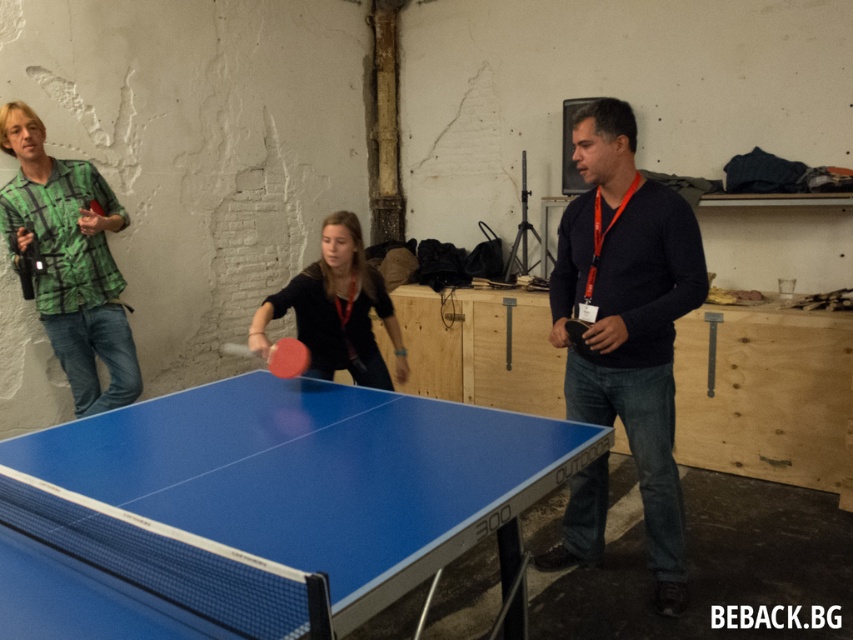
Who is taller, black matte sweater at center or matte black ping pong paddle at center?

black matte sweater at center is taller.

Who is lower down, black matte sweater at center or matte black ping pong paddle at center?

black matte sweater at center is below.

Between point (599, 464) and point (41, 259), which one is positioned in front?

Positioned in front is point (599, 464).

The width and height of the screenshot is (853, 640). Find the location of `black matte sweater at center`. black matte sweater at center is located at coordinates (628, 317).

Consider the image. How distant is blue glossy table tennis table at center from matte black ping pong paddle at center?

1.42 meters

Between blue glossy table tennis table at center and matte black ping pong paddle at center, which one appears on the left side from the viewer's perspective?

From the viewer's perspective, matte black ping pong paddle at center appears more on the left side.

Describe the element at coordinates (318, 476) in the screenshot. I see `blue glossy table tennis table at center` at that location.

I want to click on blue glossy table tennis table at center, so click(318, 476).

Image resolution: width=853 pixels, height=640 pixels. I want to click on blue glossy table tennis table at center, so click(318, 476).

Can you confirm if blue glossy table tennis table at center is thinner than black matte sweater at center?

No, blue glossy table tennis table at center is not thinner than black matte sweater at center.

Between point (206, 420) and point (576, 365), which one is positioned behind?

Point (576, 365)

Identify the location of blue glossy table tennis table at center. (318, 476).